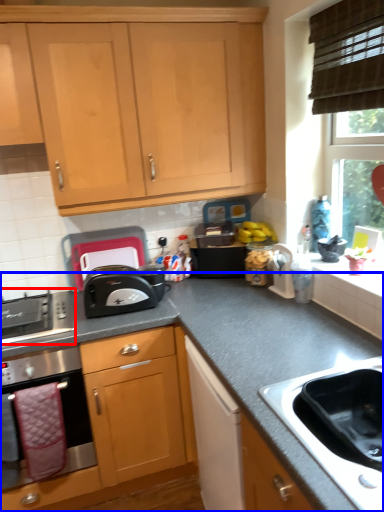
Question: Among these objects, which one is farthest to the camera, gas stove (highlighted by a red box) or countertop (highlighted by a blue box)?

Choices:
 (A) gas stove
 (B) countertop

Answer: (A)